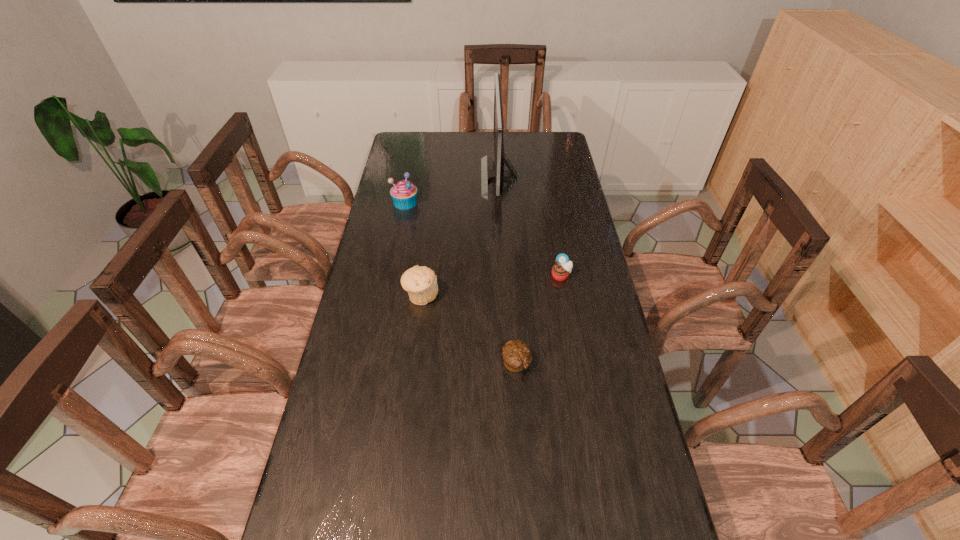
Find the location of a particular element. free space located on the front of the farthest muffin is located at coordinates (389, 285).

You are a GUI agent. You are given a task and a screenshot of the screen. Output one action in this format:
    pyautogui.click(x=<x>, y=<y>)
    Task: Click on the vacant space located 0.330m on the front of the third farthest muffin
    Image resolution: width=960 pixels, height=540 pixels.
    Given the screenshot: What is the action you would take?
    pyautogui.click(x=407, y=411)

In order to click on free space located on the front-facing side of the rightmost object in this screenshot , I will do `click(581, 386)`.

This screenshot has width=960, height=540. In order to click on vacant position located 0.160m on the front of the shortest object in this screenshot , I will do `click(521, 435)`.

At what (x,y) coordinates should I click in order to perform the action: click on object located at the far edge. Please return your answer as a coordinate pair (x, y). This screenshot has width=960, height=540. Looking at the image, I should click on (499, 174).

Identify the location of object located in the right edge section of the desktop. (560, 271).

The height and width of the screenshot is (540, 960). In the image, there is a desktop. In order to click on vacant space at the far edge in this screenshot , I will do `click(436, 147)`.

Identify the location of free region at the left edge. (369, 267).

Image resolution: width=960 pixels, height=540 pixels. Find the location of `blank area at the right edge`. blank area at the right edge is located at coordinates (616, 522).

Locate an element on the screen. The height and width of the screenshot is (540, 960). free spot at the far left corner of the desktop is located at coordinates 410,145.